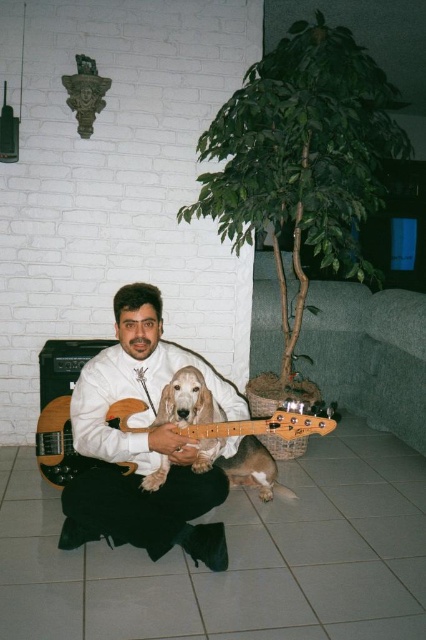
You are standing in the living room and want to pick up the wooden electric guitar at center. Is it closer to you than the wooden electric guitar at lower left?

The wooden electric guitar at center is in front of the wooden electric guitar at lower left, so it is closer to you.

You are a fashion designer analyzing the image of a man in a white shirt. You need to place a decorative pin exactly at the coordinates point (141, 444). Where on the man would this pin be placed?

The point (141, 444) is on the white matte shirt at center, so the decorative pin would be placed on the man at the center of his white matte shirt.